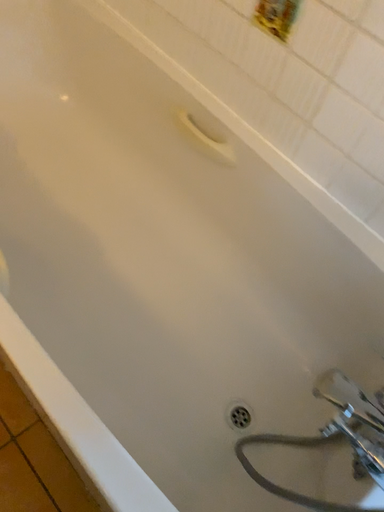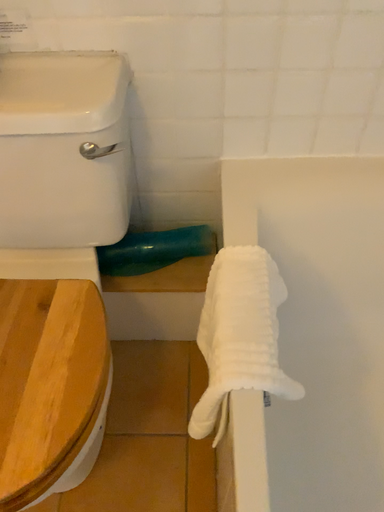
Question: Which way did the camera rotate in the video?

Choices:
 (A) rotated left
 (B) rotated right

Answer: (A)